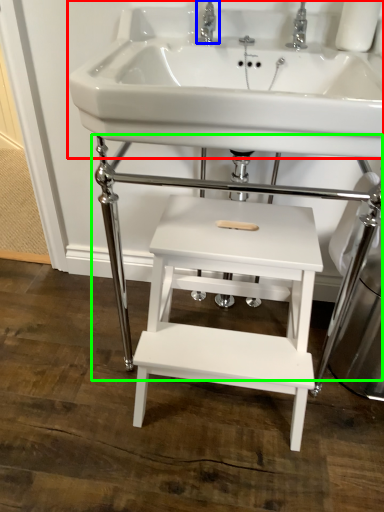
Question: Which object is the closest to the sink (highlighted by a red box)? Choose among these: tap (highlighted by a blue box) or table (highlighted by a green box).

Choices:
 (A) tap
 (B) table

Answer: (A)